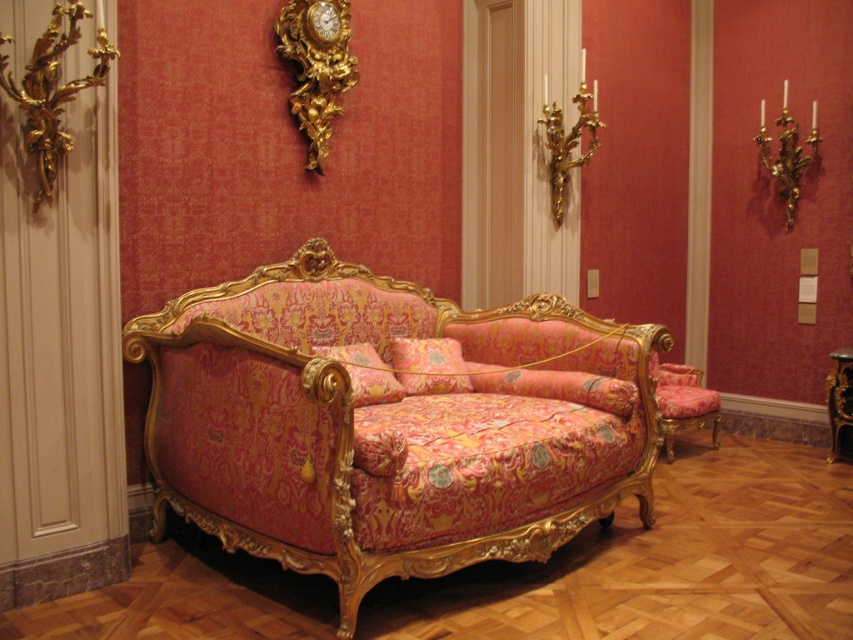
You are an interior designer planning to place a new painting on the wall in the room. The painting will be placed at the point with coordinates point (316,67). What object is located at this point?

The point (316,67) corresponds to the gold ornate clock at upper center.